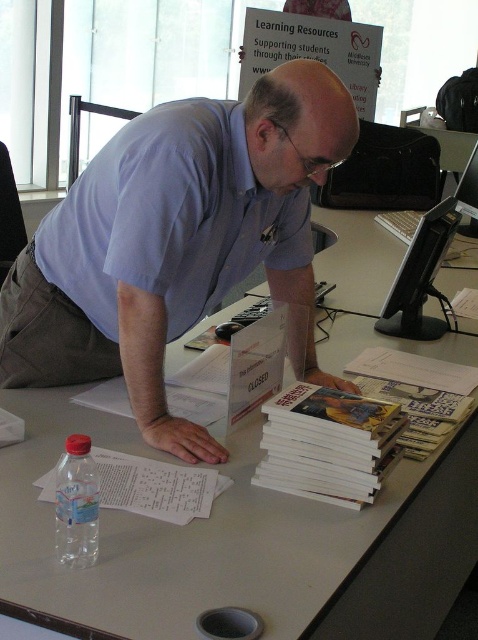
Question: Is blue cotton shirt at center further to the viewer compared to black plastic monitor at upper right?

Choices:
 (A) yes
 (B) no

Answer: (B)

Question: Among these points, which one is nearest to the camera?

Choices:
 (A) (171, 472)
 (B) (57, 464)
 (C) (428, 269)

Answer: (B)

Question: In this image, where is black plastic monitor at upper right located relative to translucent plastic bottle at lower left?

Choices:
 (A) right
 (B) left

Answer: (A)

Question: Which point is closer to the camera?

Choices:
 (A) (74, 496)
 (B) (427, 289)
 (C) (382, 285)

Answer: (A)

Question: Is white matte table at center bigger than white paper at lower left?

Choices:
 (A) yes
 (B) no

Answer: (A)

Question: Which object is closer to the camera taking this photo?

Choices:
 (A) white matte table at center
 (B) white paper at lower left
 (C) black plastic monitor at upper right

Answer: (A)